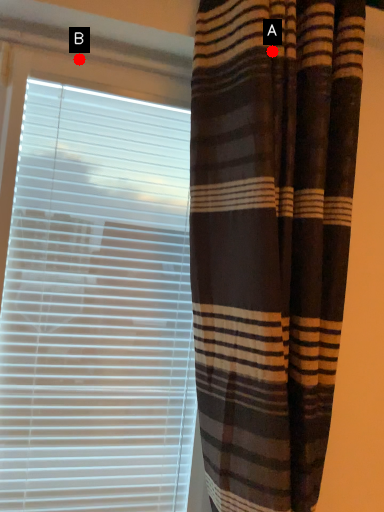
Question: Two points are circled on the image, labeled by A and B beside each circle. Which point is farther to the camera?

Choices:
 (A) A is further
 (B) B is further

Answer: (B)